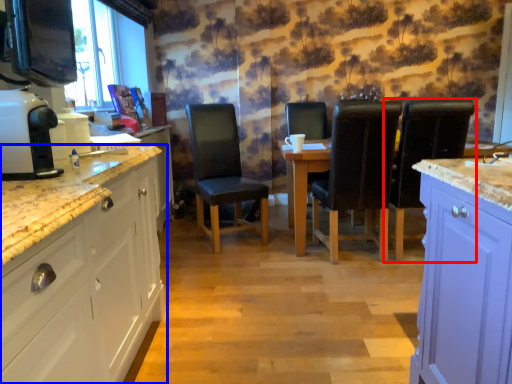
Question: Which of the following is the closest to the observer, chair (highlighted by a red box) or cabinetry (highlighted by a blue box)?

Choices:
 (A) chair
 (B) cabinetry

Answer: (B)